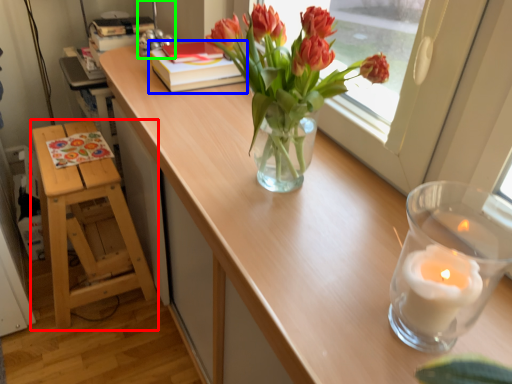
Question: Based on their relative distances, which object is farther from furniture (highlighted by a red box)? Choose from book (highlighted by a blue box) and table lamp (highlighted by a green box).

Choices:
 (A) book
 (B) table lamp

Answer: (B)